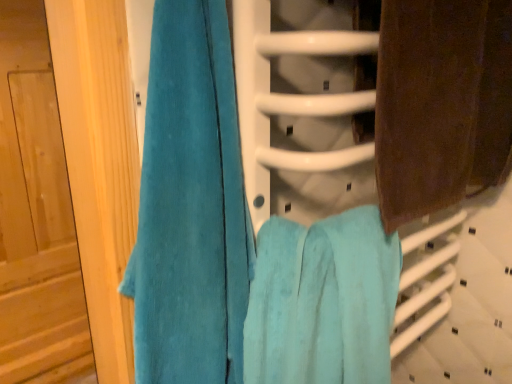
Question: Is point (462, 79) closer or farther from the camera than point (39, 145)?

Choices:
 (A) farther
 (B) closer

Answer: (B)

Question: From the image's perspective, is brown textured towel at right, acting as the 3th towel starting from the left, above or below wooden door at left?

Choices:
 (A) above
 (B) below

Answer: (A)

Question: Which is nearer to the wooden door at left?

Choices:
 (A) teal plush towel at left, the first towel positioned from the left
 (B) brown textured towel at right, the first towel when ordered from right to left
 (C) turquoise soft towel at center, the 2th towel when ordered from left to right

Answer: (A)

Question: Which object is the farthest from the teal plush towel at left, which is the third towel in right-to-left order?

Choices:
 (A) wooden door at left
 (B) turquoise soft towel at center, positioned as the second towel in right-to-left order
 (C) brown textured towel at right, acting as the 3th towel starting from the left

Answer: (A)